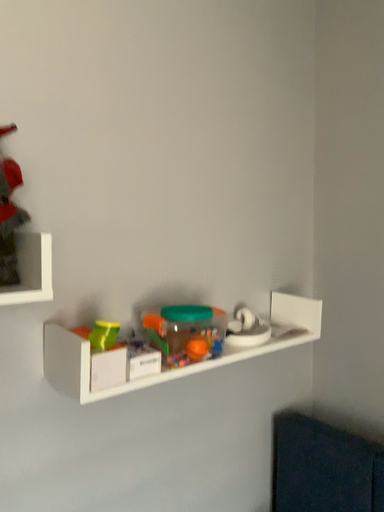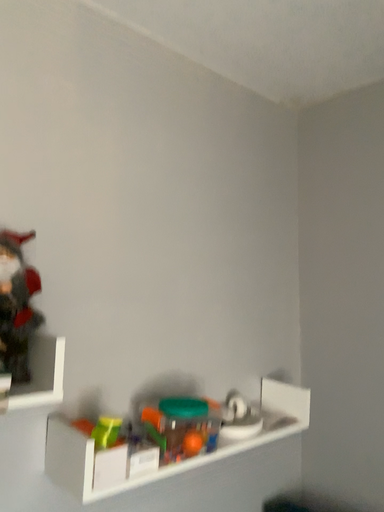
Question: How did the camera likely rotate when shooting the video?

Choices:
 (A) rotated downward
 (B) rotated upward

Answer: (B)